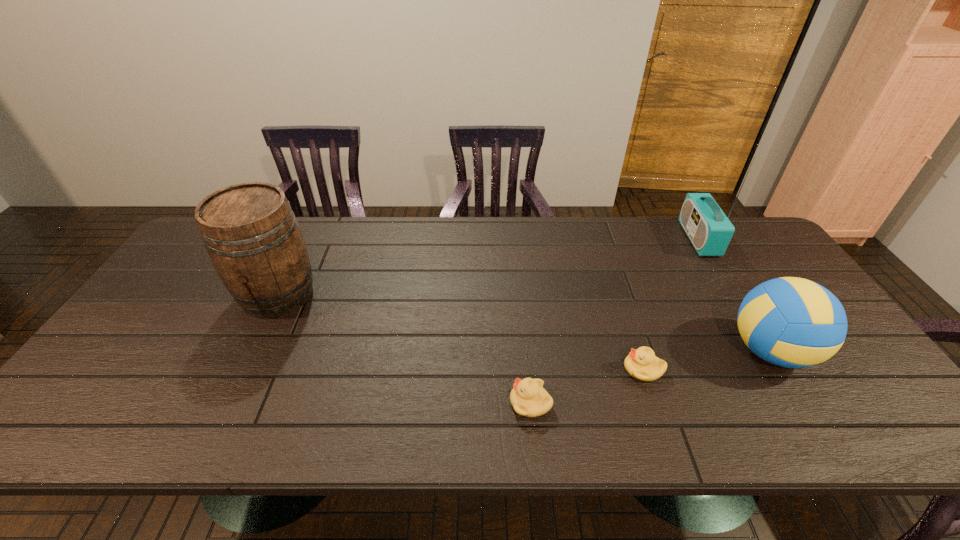
I want to click on vacant region located 0.360m on the beak of the left duckling, so click(x=351, y=403).

Find the location of a particular element. free space located 0.060m on the beak of the left duckling is located at coordinates (483, 403).

Locate an element on the screen. free location located 0.140m on the beak of the left duckling is located at coordinates (448, 403).

This screenshot has width=960, height=540. Find the location of `vacant space located at the face of the right duckling`. vacant space located at the face of the right duckling is located at coordinates (521, 369).

Locate an element on the screen. vacant space located at the face of the right duckling is located at coordinates point(591,369).

Image resolution: width=960 pixels, height=540 pixels. Identify the location of vacant region located 0.240m at the face of the right duckling. (525, 369).

At what (x,y) coordinates should I click in order to perform the action: click on object that is at the far edge. Please return your answer as a coordinate pair (x, y). The image size is (960, 540). Looking at the image, I should click on (708, 228).

This screenshot has width=960, height=540. Find the location of `object that is positioned at the near edge`. object that is positioned at the near edge is located at coordinates (528, 397).

Find the location of a particular element. This screenshot has height=540, width=960. radio receiver located in the right edge section of the desktop is located at coordinates (708, 228).

The height and width of the screenshot is (540, 960). In order to click on volleyball situated at the right edge in this screenshot , I will do `click(791, 322)`.